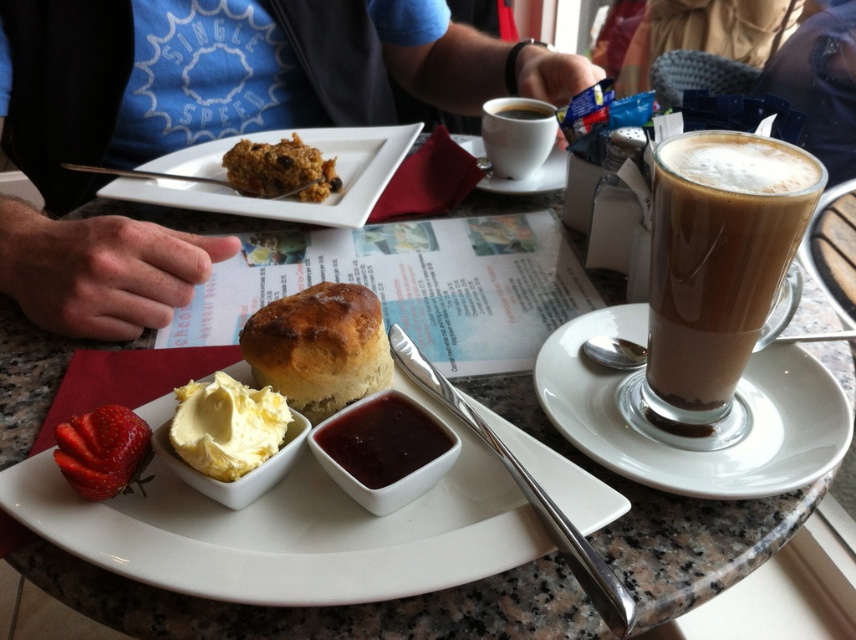
You are a customer at the cozy cafe and want to reach for the spoon next to the frothy beverage. Which object is closer to your hand if you are sitting directly in front of the table? The white ceramic saucer at right or the golden brown crusty scone at center?

The golden brown crusty scone at center is closer to your hand since the white ceramic saucer at right is positioned to its right, making it farther away from the center where you are sitting.